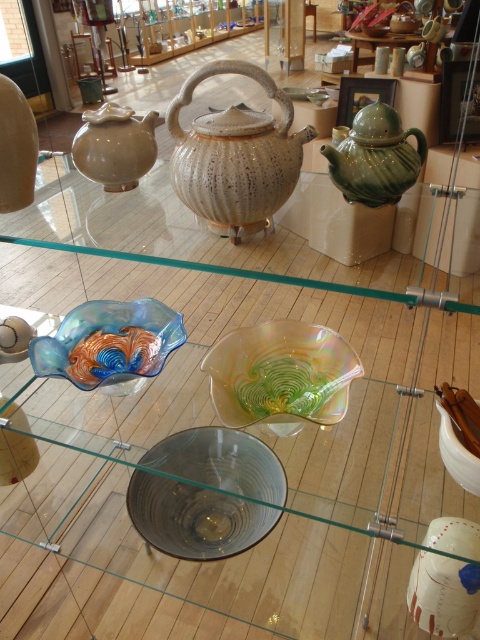
You are a customer in a shop looking at the display case. You want to know if the transparent glass bowl at center can fit inside the matte beige teapot at upper left. Can it?

The transparent glass bowl at center is bigger than the matte beige teapot at upper left, so it cannot fit inside.

You are a customer in a shop looking at the display case. There are two points marked in the case. One is at coordinate point (x=139, y=518) and the other at point (x=80, y=317). Which point is closer to you?

Point (x=139, y=518) is closer to the viewer than point (x=80, y=317).

You are a customer in a shop looking at the display case. You want to know if the iridescent glass bowl at center can fit under the matte beige teapot at upper left without touching it. Can you determine this based on their heights?

The iridescent glass bowl at center is taller than the matte beige teapot at upper left. Since the bowl is taller, placing it under the teapot would cause them to touch or not leave enough space. Therefore, it might not fit properly without touching.